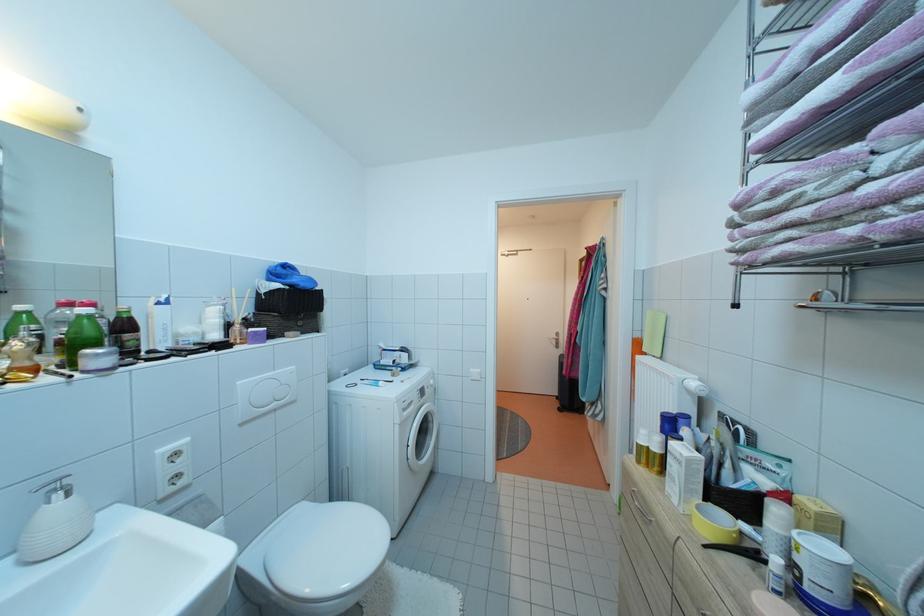
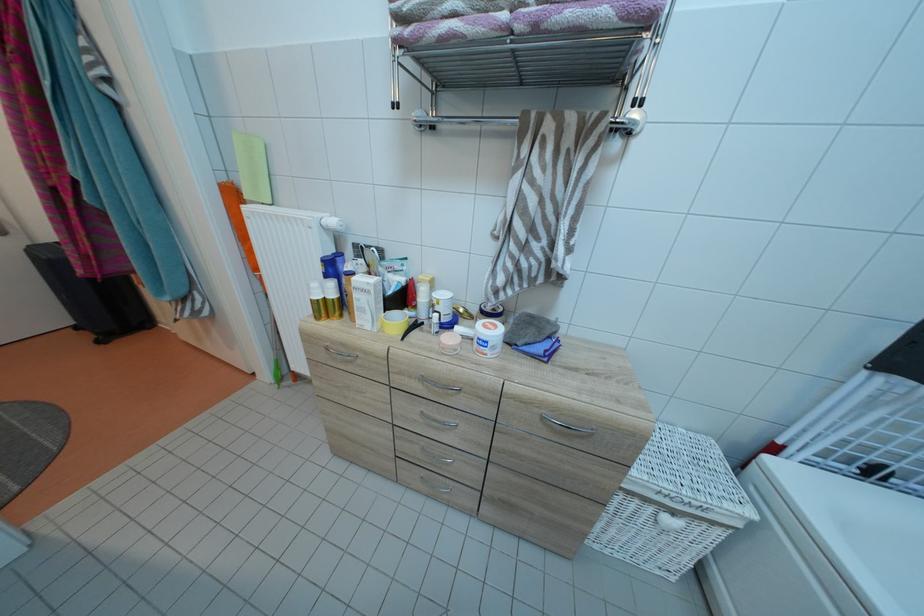
Where in the second image is the point corresponding to [666,444] from the first image?

(338, 290)